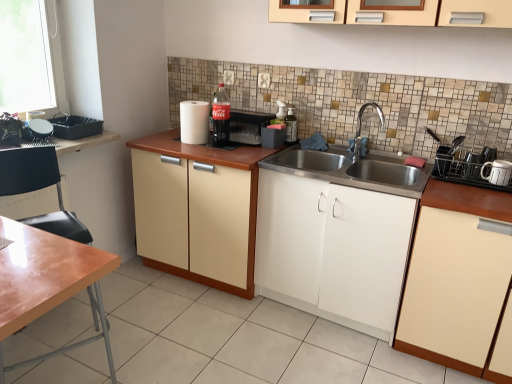
Identify the location of free space on the front side of white ceramic mug at right, the first appliance when ordered from right to left. Image resolution: width=512 pixels, height=384 pixels. (498, 192).